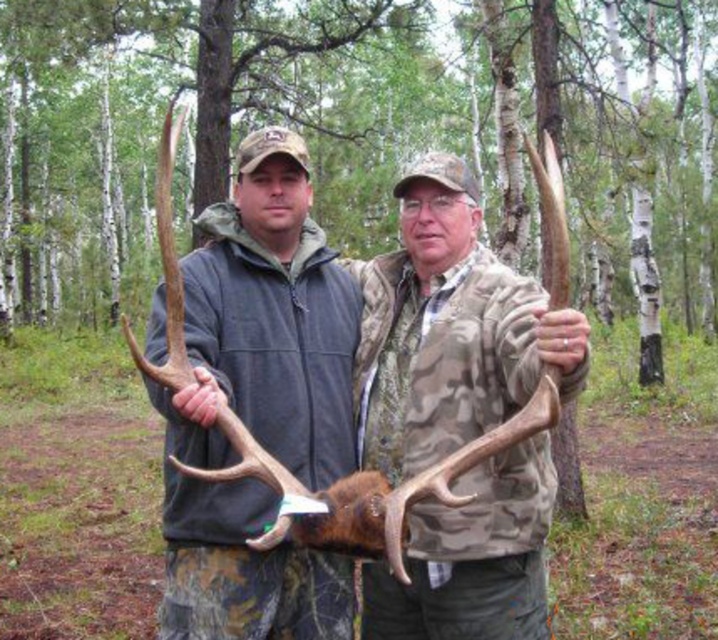
Is point (215, 289) closer to camera compared to point (531, 330)?

No, (215, 289) is further to viewer.

Which is in front, point (205, 208) or point (546, 435)?

Point (546, 435) is more forward.

Does point (164, 305) lie behind point (442, 161)?

No, it is in front of (442, 161).

Find the location of a particular element. camouflage jacket at center is located at coordinates (251, 401).

Who is lower down, matte brown antlers at center or camo-patterned jacket at center?

Positioned lower is camo-patterned jacket at center.

Is point (490, 595) positioned before point (368, 365)?

Yes, it is.

The image size is (718, 640). I want to click on matte brown antlers at center, so click(442, 333).

Is matte brown antlers at center positioned in front of camouflage jacket at center?

Yes.

Consider the image. Is matte brown antlers at center to the left of camouflage jacket at center from the viewer's perspective?

Incorrect, matte brown antlers at center is not on the left side of camouflage jacket at center.

Is point (410, 332) positioned before point (307, 333)?

Yes, point (410, 332) is closer to viewer.

Identify the location of matte brown antlers at center. This screenshot has width=718, height=640. (442, 333).